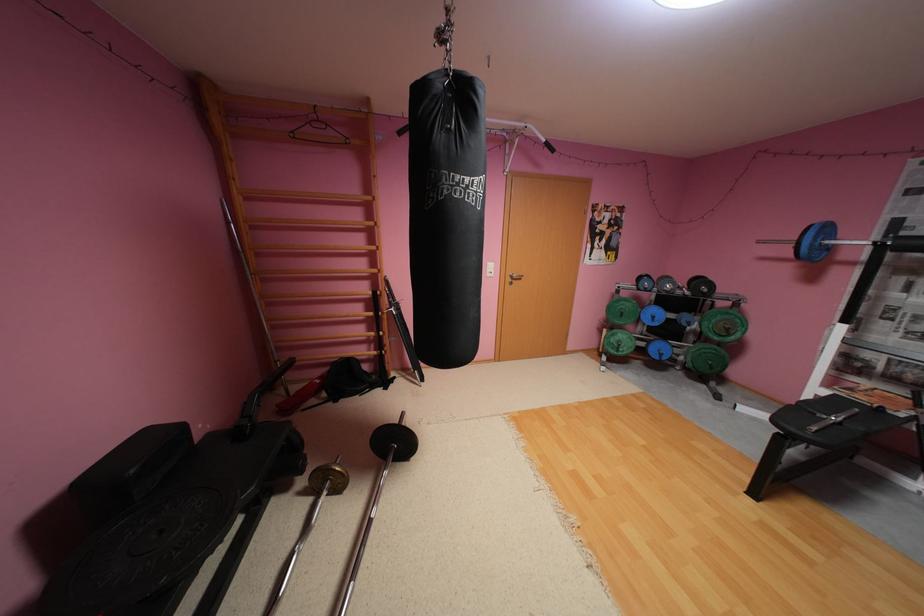
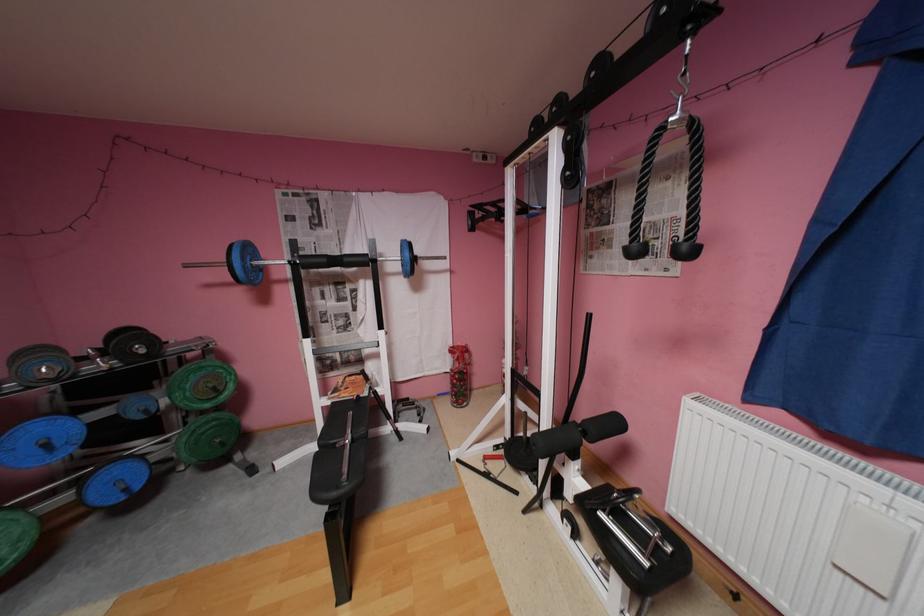
Where in the second image is the point corresponding to the point at 714,291 from the first image?

(152, 351)